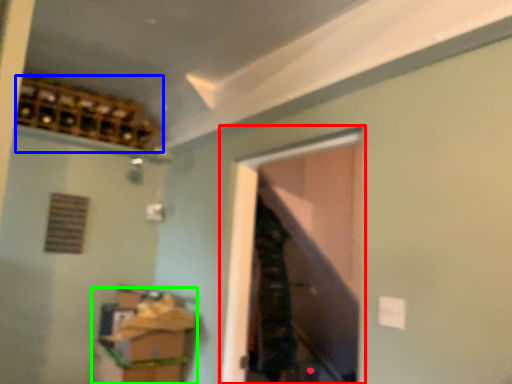
Question: Considering the real-world distances, which object is farthest from window (highlighted by a red box)? wine cabinet (highlighted by a blue box) or cabinetry (highlighted by a green box)?

Choices:
 (A) wine cabinet
 (B) cabinetry

Answer: (A)